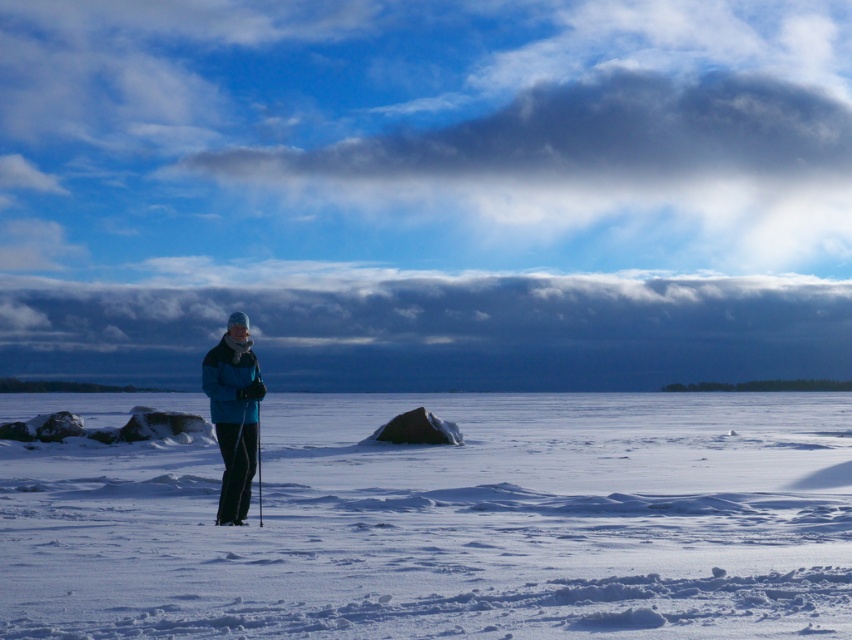
You are a photographer trying to capture the scene of the person skiing. You want to ensure the blue fleece jacket at center and the white powdery snow at center are both clearly visible in your shot. Which object should you focus on first to ensure both are in focus?

The blue fleece jacket at center is above the white powdery snow at center, so focusing on the blue fleece jacket at center first will ensure both are in focus as the snow is below it.

Looking at this image, you are a winter sports instructor planning a cross country ski trail. The trail must start at the person in the image and end at the white powdery snow at center. What is the minimum distance you need to plan for the trail?

The minimum distance you need to plan for the trail is 9.80 meters.

Based on the photo, you are a photographer trying to capture the scene with the white powdery snow at center and the blue fleece jacket at center. Based on their positions, which object will appear closer to the camera in the photo?

The white powdery snow at center appears closer to the camera because it is positioned in front of the blue fleece jacket at center.